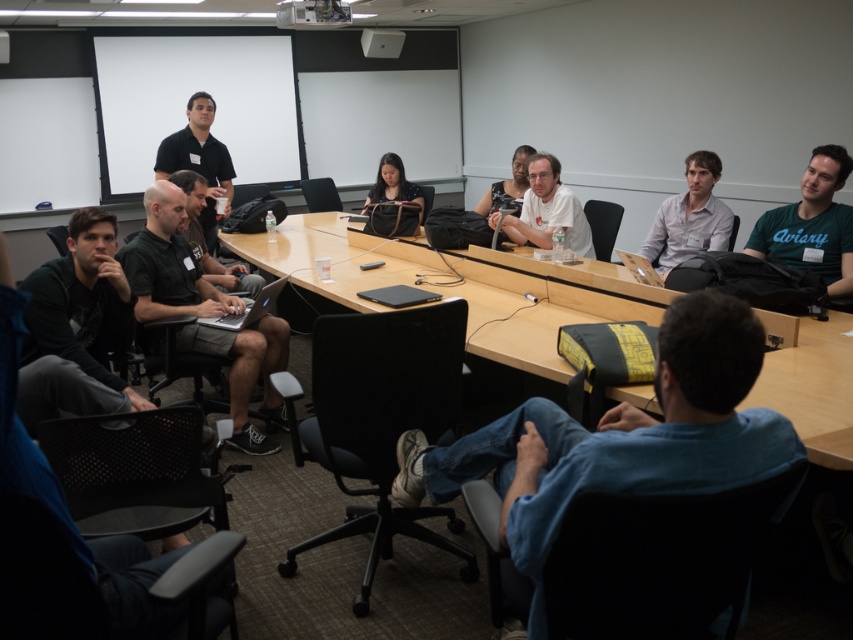
Identify the location of black matte shirt at upper center. This screenshot has width=853, height=640. (199, 160).

Does point (225, 160) come in front of point (207, 276)?

No, (225, 160) is further to viewer.

Does point (204, 160) come in front of point (242, 284)?

No, (204, 160) is behind (242, 284).

This screenshot has width=853, height=640. What are the coordinates of `black matte shirt at upper center` in the screenshot? It's located at (199, 160).

Is matte brown bag at center above matte black shirt at center?

No.

Who is positioned more to the left, matte brown bag at center or matte black shirt at center?

matte brown bag at center

This screenshot has width=853, height=640. I want to click on matte brown bag at center, so click(392, 186).

In the scene shown: Who is positioned more to the right, silver metallic laptop at center or matte black shirt at center?

matte black shirt at center is more to the right.

From the picture: Does silver metallic laptop at center have a greater height compared to matte black shirt at center?

In fact, silver metallic laptop at center may be shorter than matte black shirt at center.

Between point (267, 308) and point (482, 198), which one is positioned in front?

Point (267, 308)

Where is `silver metallic laptop at center`? This screenshot has height=640, width=853. silver metallic laptop at center is located at coordinates (248, 308).